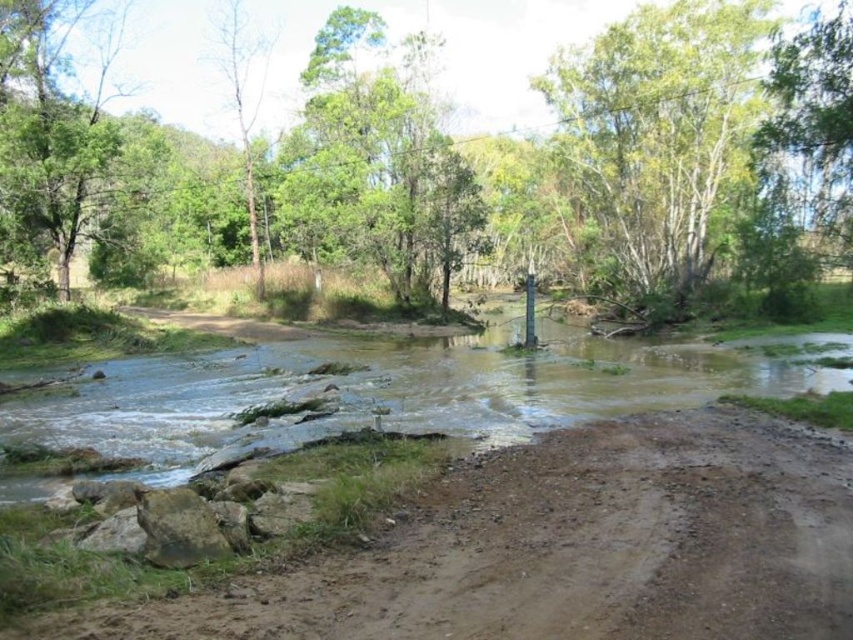
Between brown dirt track at lower left and brown muddy stream at center, which one appears on the right side from the viewer's perspective?

brown muddy stream at center is more to the right.

Can you confirm if brown dirt track at lower left is wider than brown muddy stream at center?

No, brown dirt track at lower left is not wider than brown muddy stream at center.

What do you see at coordinates (566, 547) in the screenshot?
I see `brown dirt track at lower left` at bounding box center [566, 547].

Image resolution: width=853 pixels, height=640 pixels. I want to click on brown dirt track at lower left, so click(x=566, y=547).

Is green leafy tree at center wider than brown muddy stream at center?

Yes.

Is point (57, 264) positioned behind point (187, 388)?

Yes, it is behind point (187, 388).

Is point (674, 173) more distant than point (492, 340)?

That is True.

Where is `green leafy tree at center`? The image size is (853, 640). green leafy tree at center is located at coordinates (477, 170).

Can you confirm if brown dirt track at lower left is smaller than green leafy tree at upper center?

Yes.

Which of these two, brown dirt track at lower left or green leafy tree at upper center, stands shorter?

With less height is brown dirt track at lower left.

Is point (751, 572) positioned in front of point (630, 19)?

Yes, it is.

The height and width of the screenshot is (640, 853). I want to click on brown dirt track at lower left, so click(x=566, y=547).